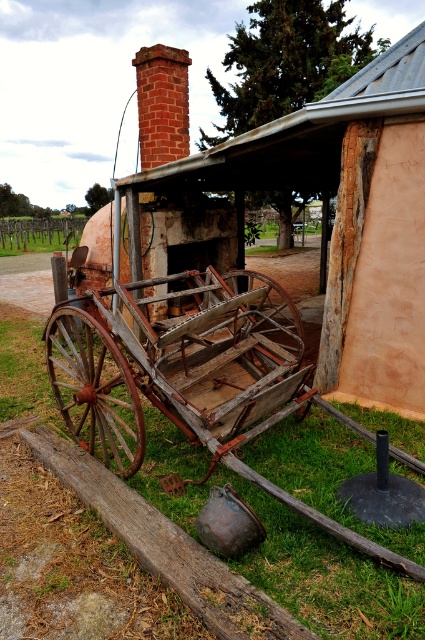
You are a farmer who needs to transport a large bundle of hay. You have the rusty wood cart at center and the rusty wooden wagon wheel at center available. Which object can you use to carry the hay?

The rusty wood cart at center is larger in size than the rusty wooden wagon wheel at center, so the farmer can use the rusty wood cart at center to carry the hay since it is bigger and more suitable for transporting large items.

You are a farmer who needs to move a 1.5 meter wide bale of hay from the rusty wood cart at lower left to the rusty wood cart at center. Can the bale of hay fit between them without touching either cart?

The distance between the rusty wood cart at center and the rusty wood cart at lower left is 1.73 meters. Since the bale of hay is 1.5 meters wide, there is enough space for it to fit between them without touching either cart.